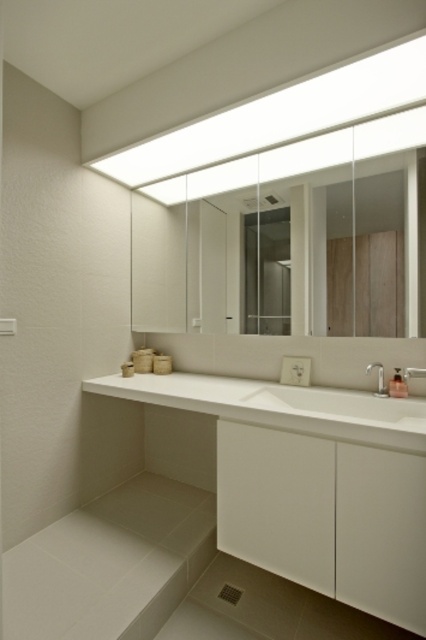
You are standing in the bathroom and want to place a toothbrush holder on the counter near the white glossy sink at center. Based on the sink location, where should you place it?

Since the white glossy sink at center is located at point 2D coordinates (340, 406), the toothbrush holder should be placed near those coordinates on the counter.

You are a plumber inspecting the bathroom. You notice two satin nickel faucets. The first is labeled as satin nickel faucet at right, and the second is labeled as satin nickel faucet at sink right. Which faucet is larger in size?

The satin nickel faucet at right is bigger than the satin nickel faucet at sink right according to the description.

You are standing in the bathroom and want to place a small decorative item on the countertop. There are two points marked on the countertop at coordinates point (235,230) and point (409,369). Which point is closer to the mirror?

Point (235,230) is behind point (409,369), so it is closer to the mirror.